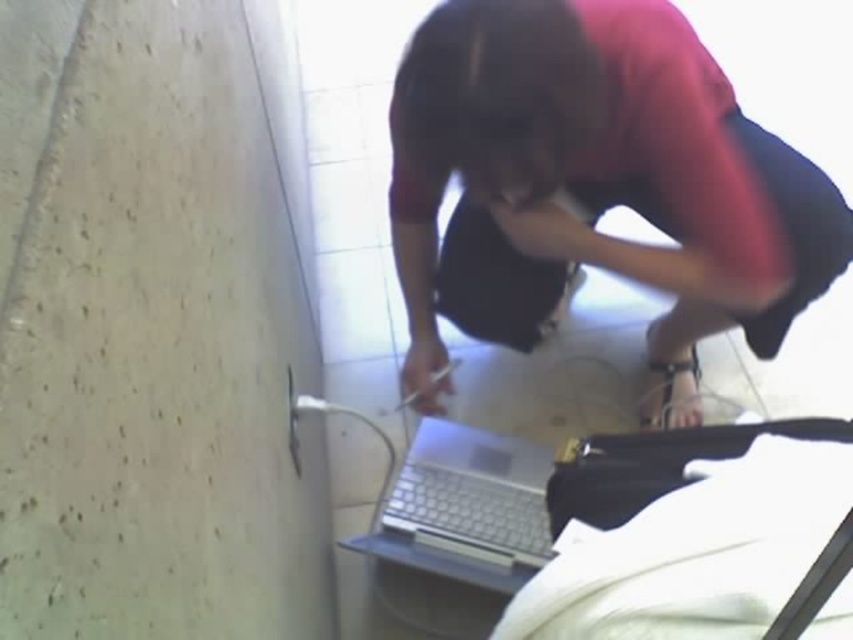
Which of these two, matte black laptop at lower center or silver metallic laptop at lower center, stands shorter?

Standing shorter between the two is silver metallic laptop at lower center.

Can you confirm if matte black laptop at lower center is positioned to the left of silver metallic laptop at lower center?

No, matte black laptop at lower center is not to the left of silver metallic laptop at lower center.

The height and width of the screenshot is (640, 853). Describe the element at coordinates (595, 179) in the screenshot. I see `matte black laptop at lower center` at that location.

Locate an element on the screen. matte black laptop at lower center is located at coordinates (595, 179).